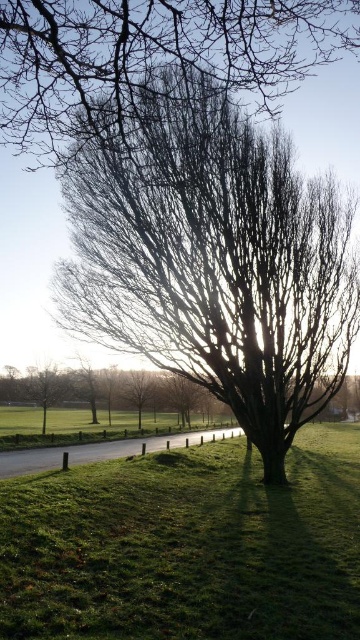
From the picture: Does bare branches at upper center appear under smooth bark tree at center?

Incorrect, bare branches at upper center is not positioned below smooth bark tree at center.

Is bare branches at upper center shorter than smooth bark tree at center?

Incorrect, bare branches at upper center's height does not fall short of smooth bark tree at center's.

Measure the distance between point (209, 13) and camera.

Point (209, 13) and camera are 6.55 meters apart.

The image size is (360, 640). What are the coordinates of `bare branches at upper center` in the screenshot? It's located at (154, 52).

Can you confirm if bare branches at upper center is positioned below green matte tree at lower left?

Incorrect, bare branches at upper center is not positioned below green matte tree at lower left.

The image size is (360, 640). What do you see at coordinates (154, 52) in the screenshot? I see `bare branches at upper center` at bounding box center [154, 52].

Is point (96, 104) positioned behind point (60, 387)?

No, (96, 104) is in front of (60, 387).

In order to click on bare branches at upper center in this screenshot , I will do `click(154, 52)`.

Who is positioned more to the right, bare branches at center or bare branches at upper center?

Positioned to the right is bare branches at upper center.

Measure the distance between bare branches at center and bare branches at upper center.

3.45 meters

Does point (100, 211) come farther from viewer compared to point (201, 17)?

That is True.

Where is `bare branches at center`? This screenshot has width=360, height=640. bare branches at center is located at coordinates (213, 257).